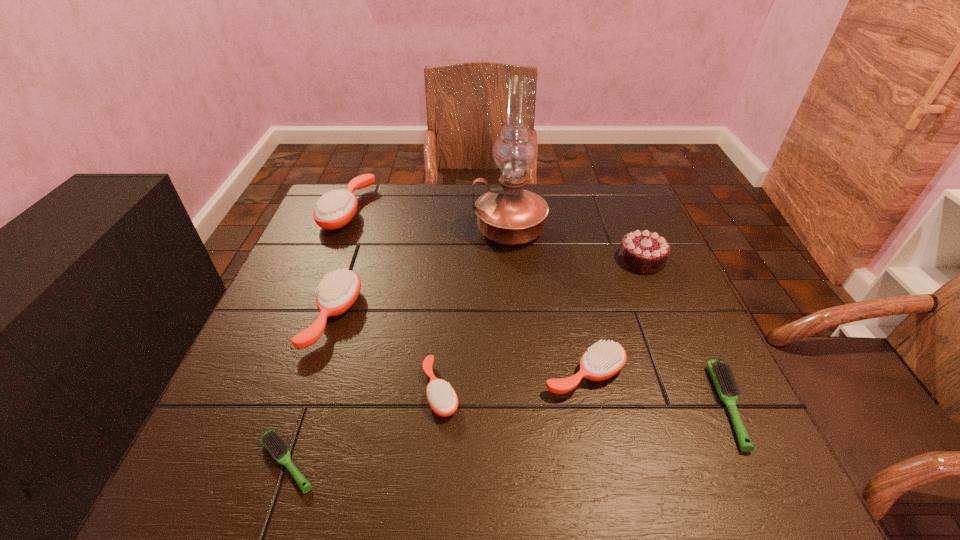
Where is `orange hairbrush that is the second closest one to the third tallest hairbrush`? This screenshot has height=540, width=960. orange hairbrush that is the second closest one to the third tallest hairbrush is located at coordinates (338, 291).

Find the location of a particular element. The image size is (960, 540). free space that satisfies the following two spatial constraints: 1. on the back side of the third hairbrush from right to left; 2. on the right side of the oil lamp is located at coordinates (453, 230).

Image resolution: width=960 pixels, height=540 pixels. Identify the location of free space that satisfies the following two spatial constraints: 1. on the front side of the seventh tallest object; 2. on the right side of the farthest orange hairbrush. (270, 406).